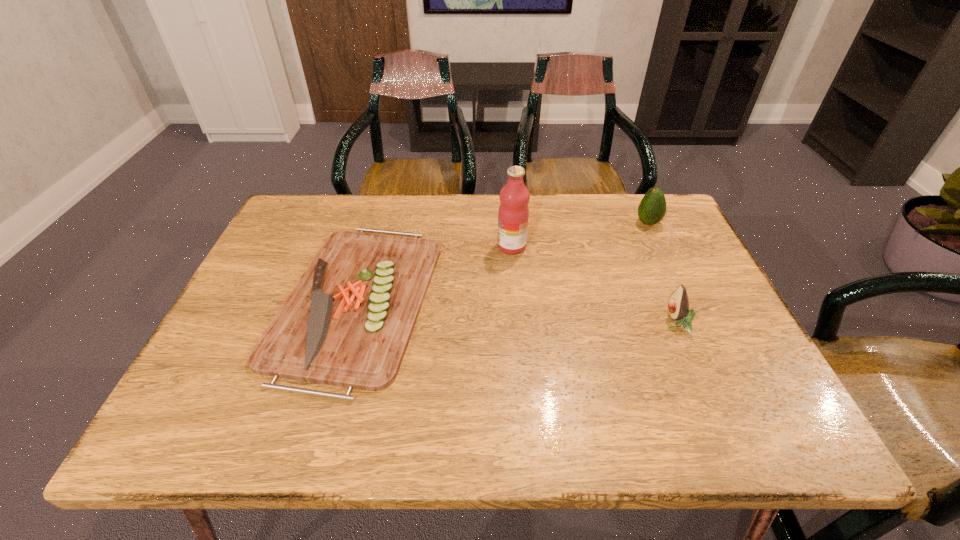
At what (x,y) coordinates should I click in order to perform the action: click on the tallest object. Please return your answer as a coordinate pair (x, y). Looking at the image, I should click on (513, 214).

In order to click on fruit juice in this screenshot , I will do `click(513, 214)`.

Where is `the farther avocado`? The width and height of the screenshot is (960, 540). the farther avocado is located at coordinates (652, 208).

This screenshot has width=960, height=540. I want to click on the nearer avocado, so click(x=678, y=304).

Find the location of a particular element. This screenshot has width=960, height=540. the shortest object is located at coordinates (347, 322).

You are a GUI agent. You are given a task and a screenshot of the screen. Output one action in this format:
    pyautogui.click(x=<x>, y=<y>)
    Task: Click on the leftmost object
    
    Given the screenshot: What is the action you would take?
    pyautogui.click(x=347, y=322)

At what (x,y) coordinates should I click in order to perform the action: click on free space located on the label of the tallest object. Please return your answer as a coordinate pair (x, y). This screenshot has width=960, height=540. Looking at the image, I should click on (406, 246).

Image resolution: width=960 pixels, height=540 pixels. Find the location of `vacant region located on the label of the tallest object`. vacant region located on the label of the tallest object is located at coordinates (417, 246).

The width and height of the screenshot is (960, 540). In order to click on vacant space located 0.100m on the label of the tallest object in this screenshot , I will do `click(461, 246)`.

The height and width of the screenshot is (540, 960). Find the location of `free region located 0.320m on the front of the farther avocado`. free region located 0.320m on the front of the farther avocado is located at coordinates 690,313.